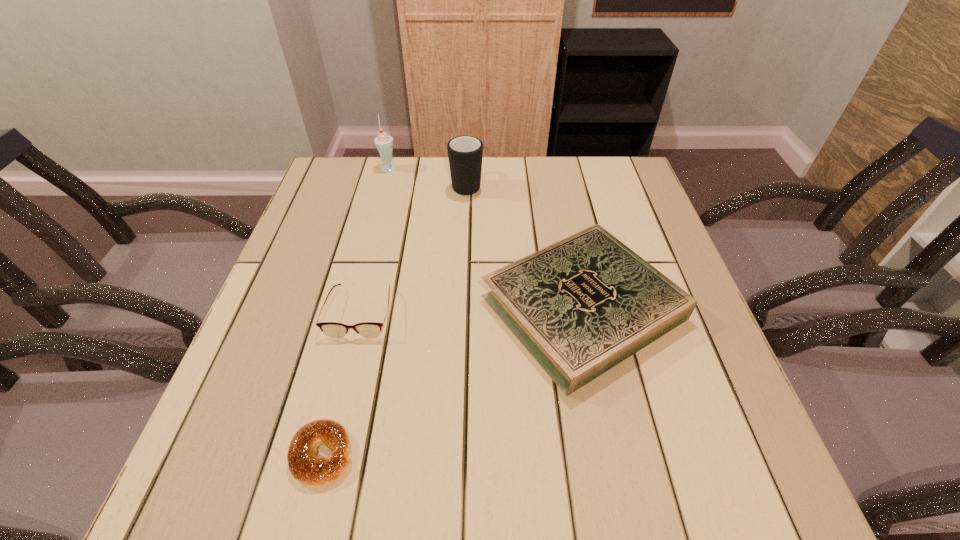
Locate an element on the screen. Image resolution: width=960 pixels, height=540 pixels. milkshake is located at coordinates (384, 143).

I want to click on mug, so click(x=465, y=153).

Locate an element on the screen. the third shortest object is located at coordinates (581, 306).

I want to click on spectacles, so coord(332,329).

Locate an element on the screen. Image resolution: width=960 pixels, height=540 pixels. bagel is located at coordinates (306, 466).

Find the location of a particular element. The height and width of the screenshot is (540, 960). the nearest object is located at coordinates (306, 466).

The width and height of the screenshot is (960, 540). Find the location of `vacant space situated 0.210m on the straw side of the milkshake`. vacant space situated 0.210m on the straw side of the milkshake is located at coordinates 467,166.

At what (x,y) coordinates should I click in order to perform the action: click on vacant area located 0.080m on the side of the mug with the handle. Please return your answer as a coordinate pair (x, y). This screenshot has width=960, height=540. Looking at the image, I should click on (468, 157).

You are a GUI agent. You are given a task and a screenshot of the screen. Output one action in this format:
    pyautogui.click(x=<x>, y=<y>)
    Task: Click on the free space located on the side of the mug with the handle
    
    Given the screenshot: What is the action you would take?
    pyautogui.click(x=468, y=158)

Find the location of a particular element. Image resolution: width=960 pixels, height=540 pixels. blank space located on the side of the mug with the handle is located at coordinates (468, 158).